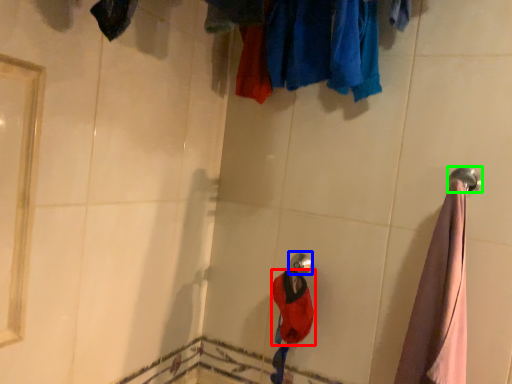
Question: Which object is positioned closest to clothing (highlighted by a red box)? Select from shower (highlighted by a blue box) and towel rack (highlighted by a green box).

Choices:
 (A) shower
 (B) towel rack

Answer: (A)